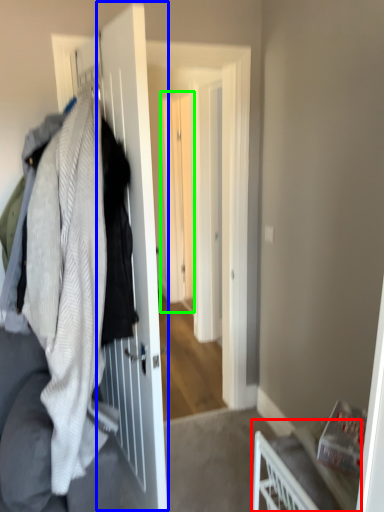
Question: Based on their relative distances, which object is farther from furniture (highlighted by a red box)? Choose from screen door (highlighted by a blue box) and screen door (highlighted by a green box).

Choices:
 (A) screen door
 (B) screen door

Answer: (B)